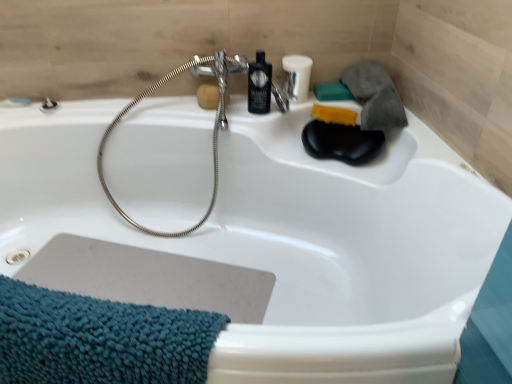
Question: From a real-world perspective, relative to teal chenille towel at lower left, is teal matte soap at upper right, arranged as the first soap when viewed from the right, vertically above or below?

Choices:
 (A) below
 (B) above

Answer: (B)

Question: Looking at their shapes, would you say teal matte soap at upper right, arranged as the first soap when viewed from the right, is wider or thinner than teal chenille towel at lower left?

Choices:
 (A) thin
 (B) wide

Answer: (A)

Question: Based on their relative distances, which object is farther from the teal chenille towel at lower left?

Choices:
 (A) brushed metal shower at upper left
 (B) black plastic mouthwash at upper center
 (C) teal matte soap at upper right, arranged as the first soap when viewed from the right
 (D) silver metallic garden hose at upper center
 (E) brown sponge at upper center, positioned as the 3th soap in right-to-left order

Answer: (C)

Question: Which object is the farthest from the teal chenille towel at lower left?

Choices:
 (A) brushed metal shower at upper left
 (B) matte black bottle at upper center
 (C) silver metallic garden hose at upper center
 (D) teal matte soap at upper right, which is the third soap in left-to-right order
 (E) yellow sponge at upper right, placed as the 2th soap when sorted from right to left

Answer: (D)